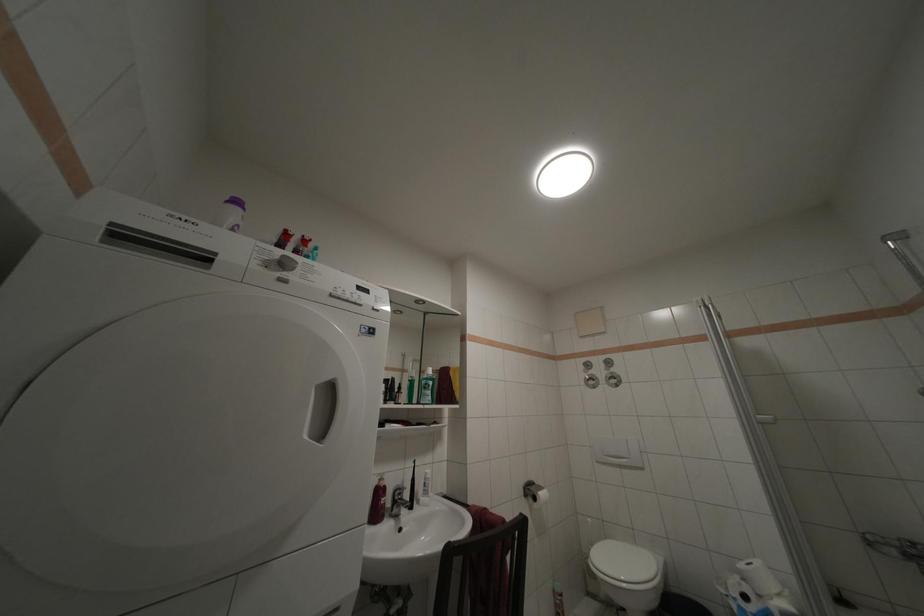
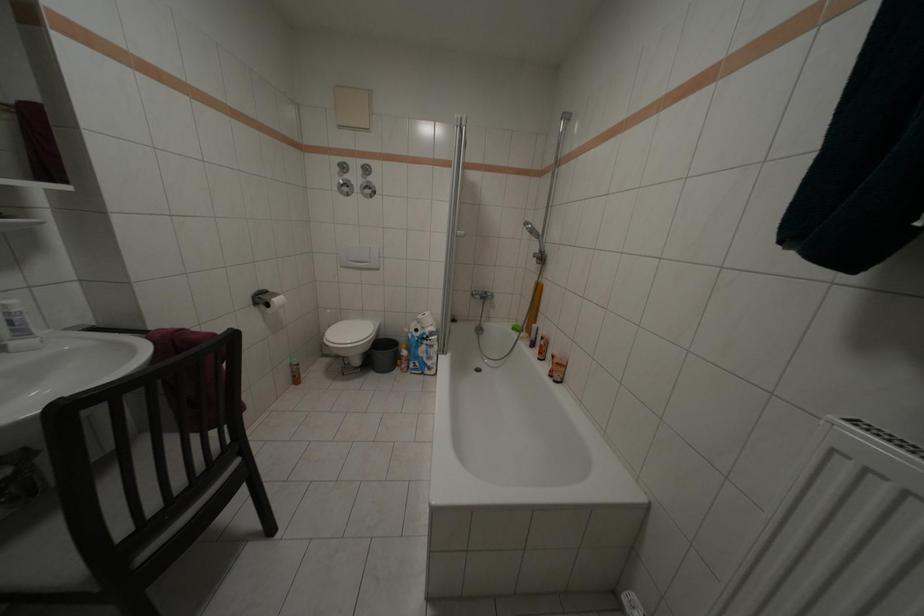
How did the camera likely rotate?

The rotation direction of the camera is right-down.